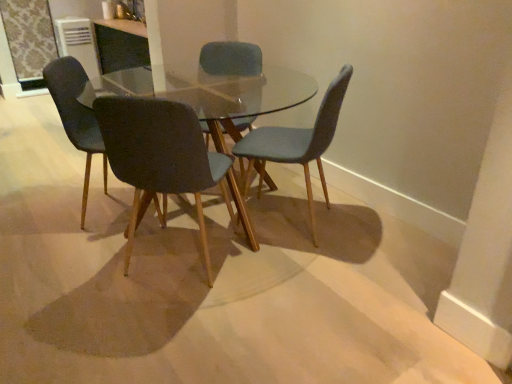
I want to click on vacant area located to the right-hand side of matte black chair at center, marked as the 3th chair in a right-to-left arrangement, so click(x=276, y=277).